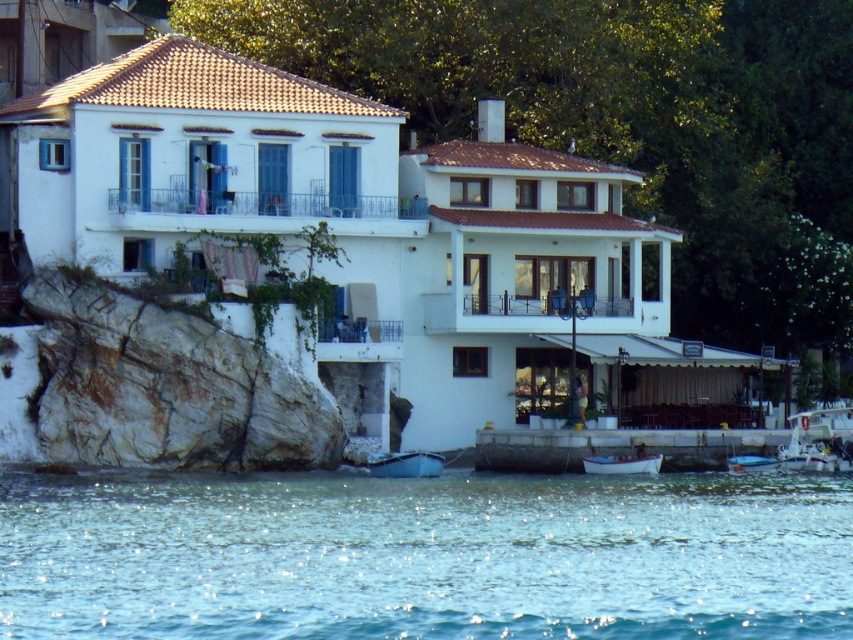
Question: Is clear blue water at lower center smaller than metallic blue boat at lower right?

Choices:
 (A) yes
 (B) no

Answer: (B)

Question: Which point is closer to the camera taking this photo?

Choices:
 (A) (35, 548)
 (B) (114, 284)
 (C) (410, 461)

Answer: (A)

Question: Does clear blue water at lower center have a lesser width compared to metallic blue boat at lower right?

Choices:
 (A) yes
 (B) no

Answer: (B)

Question: Which point is farther to the camera?

Choices:
 (A) white glossy boat at lower center
 (B) white rock at lower left
 (C) white plastic boat at lower right

Answer: (C)

Question: Can you confirm if white rock at lower left is positioned below blue matte boat at lower center?

Choices:
 (A) no
 (B) yes

Answer: (A)

Question: Which of these objects is positioned closest to the blue matte boat at lower center?

Choices:
 (A) clear blue water at lower center
 (B) white rock at lower left
 (C) white glossy boat at lower center
 (D) metallic blue boat at lower right

Answer: (C)